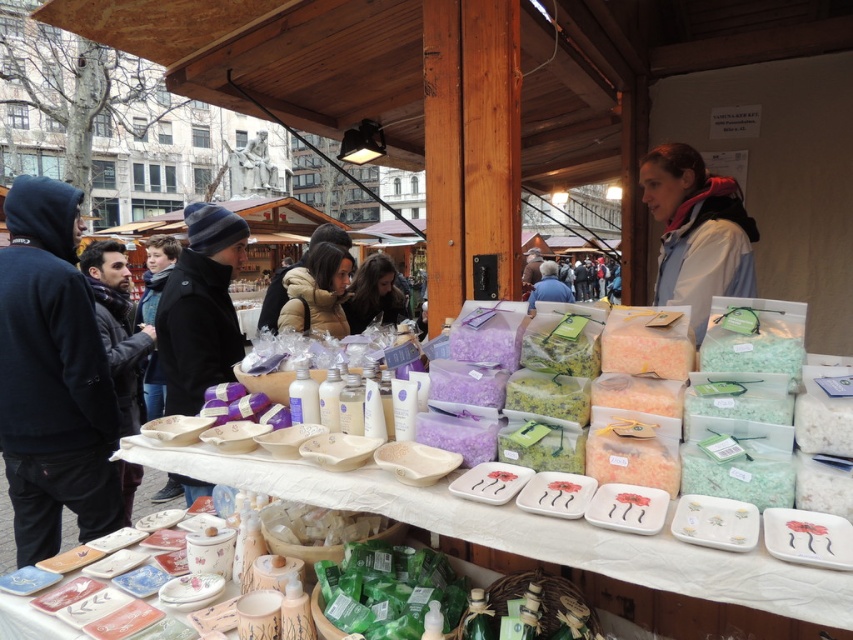
Consider the image. Is black knit hat at left shorter than black wool coat at left?

Yes, black knit hat at left is shorter than black wool coat at left.

The image size is (853, 640). In order to click on black knit hat at left in this screenshot , I will do `click(200, 308)`.

Is point (160, 362) positioned in front of point (86, 250)?

Yes, it is in front of point (86, 250).

Where is `black knit hat at left`? Image resolution: width=853 pixels, height=640 pixels. black knit hat at left is located at coordinates (200, 308).

Looking at this image, is gray fleece jacket at upper right to the right of puffy white jacket at center from the viewer's perspective?

Indeed, gray fleece jacket at upper right is positioned on the right side of puffy white jacket at center.

Who is positioned more to the left, gray fleece jacket at upper right or puffy white jacket at center?

Positioned to the left is puffy white jacket at center.

Is point (691, 237) farther from camera compared to point (341, 288)?

No, it is not.

The image size is (853, 640). Identify the location of gray fleece jacket at upper right. (695, 232).

Between gray fleece jacket at upper right and black knit hat at left, which one has more height?

black knit hat at left is taller.

Is gray fleece jacket at upper right closer to the viewer compared to black knit hat at left?

That is True.

What do you see at coordinates (695, 232) in the screenshot? The width and height of the screenshot is (853, 640). I see `gray fleece jacket at upper right` at bounding box center [695, 232].

In order to click on gray fleece jacket at upper right in this screenshot , I will do `click(695, 232)`.